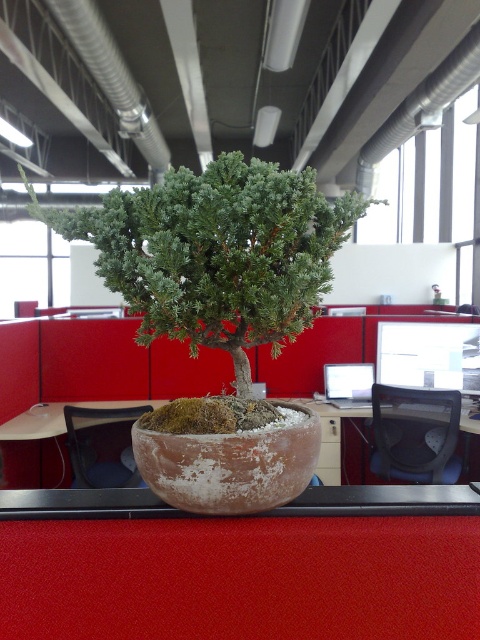
Can you confirm if matte wood computer desk at center is smaller than matte black monitor at center?

No, matte wood computer desk at center is not smaller than matte black monitor at center.

The width and height of the screenshot is (480, 640). Describe the element at coordinates (337, 440) in the screenshot. I see `matte wood computer desk at center` at that location.

Where is `matte wood computer desk at center`? This screenshot has height=640, width=480. matte wood computer desk at center is located at coordinates (337, 440).

Who is higher up, green textured bonsai at center or matte brown desk at center?

green textured bonsai at center

From the picture: Can you confirm if green textured bonsai at center is smaller than matte brown desk at center?

No, green textured bonsai at center is not smaller than matte brown desk at center.

The height and width of the screenshot is (640, 480). In order to click on green textured bonsai at center in this screenshot , I will do `click(216, 253)`.

Can you confirm if matte wood computer desk at center is bigger than matte brown desk at center?

Yes.

What do you see at coordinates (337, 440) in the screenshot?
I see `matte wood computer desk at center` at bounding box center [337, 440].

Describe the element at coordinates (337, 440) in the screenshot. The image size is (480, 640). I see `matte wood computer desk at center` at that location.

Identify the location of matte wood computer desk at center. Image resolution: width=480 pixels, height=640 pixels. (337, 440).